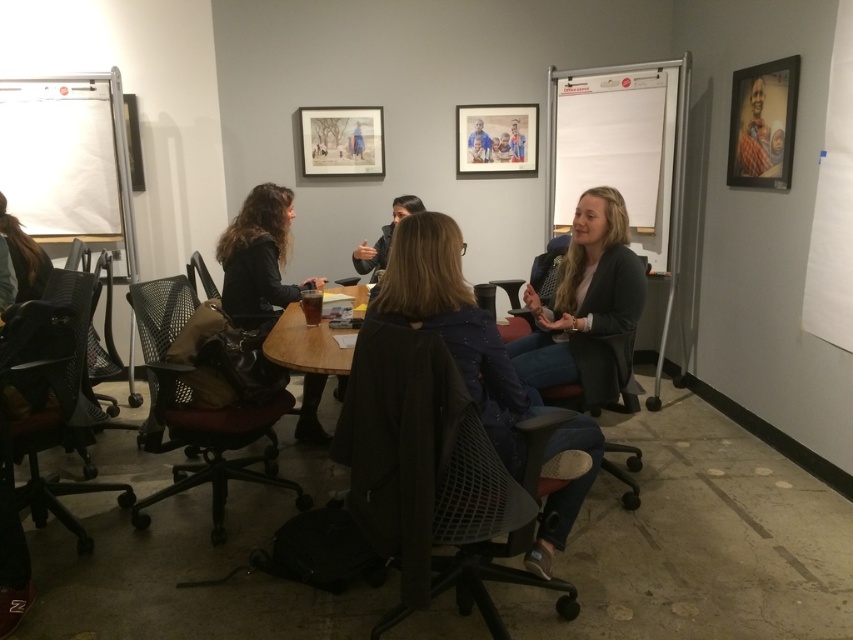
Where is the matte black blazer at center located in the image?

The matte black blazer at center is located at the 2D coordinates point [585,305] in the image.